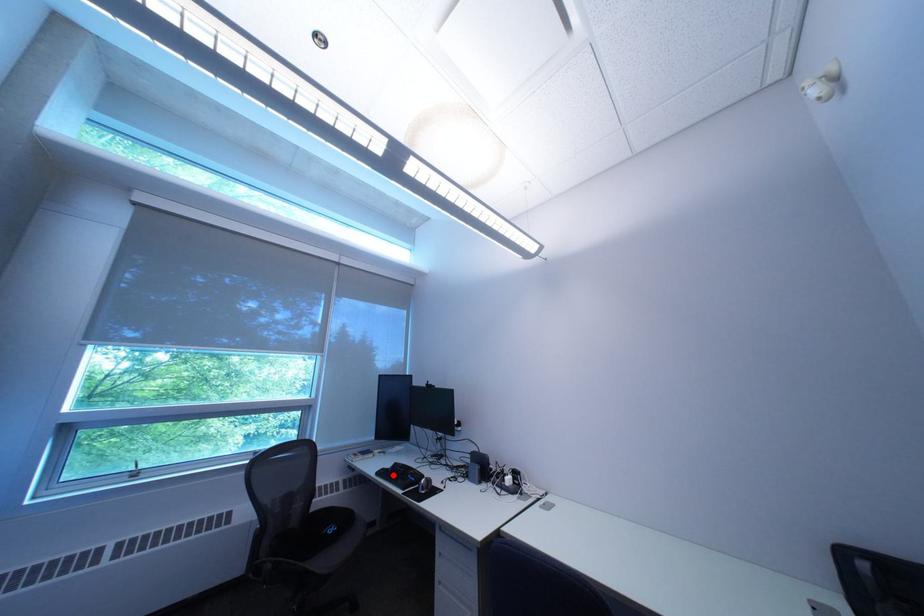
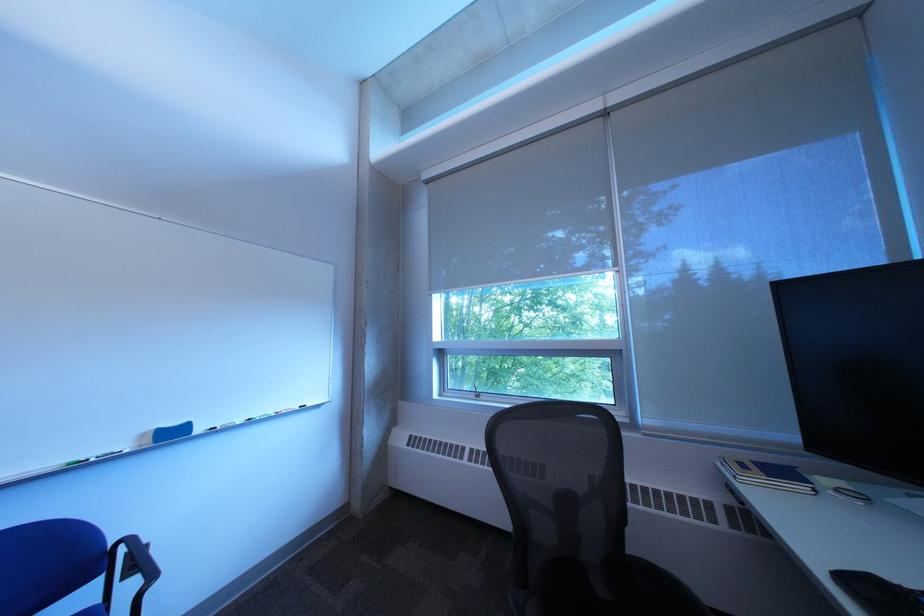
Locate, in the second image, the point that corresponds to the highlighted location in the first image.

(860, 582)